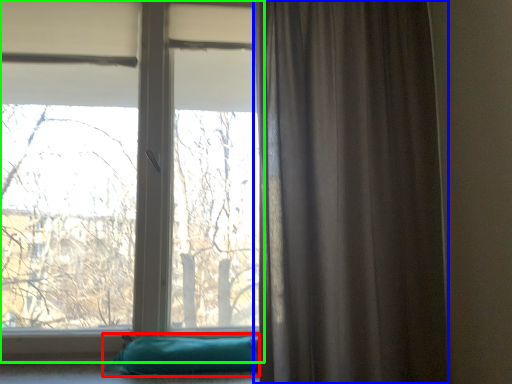
Question: Based on their relative distances, which object is farther from pillow (highlighted by a red box)? Choose from curtain (highlighted by a blue box) and window (highlighted by a green box).

Choices:
 (A) curtain
 (B) window

Answer: (B)